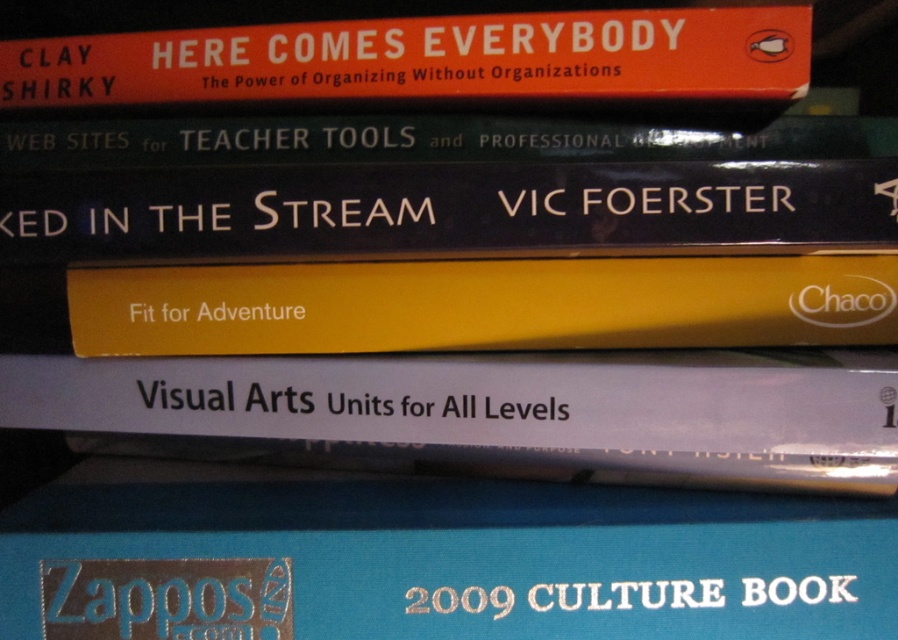
Question: Does white paper at center have a greater width compared to black matte book at center?

Choices:
 (A) yes
 (B) no

Answer: (A)

Question: Which point is closer to the camera?

Choices:
 (A) blue hardcover book at lower center
 (B) yellow matte book at center
 (C) black matte book at center

Answer: (C)

Question: Is black matte book at center closer to the viewer compared to orange matte book at upper center?

Choices:
 (A) yes
 (B) no

Answer: (A)

Question: Is blue hardcover book at lower center below black matte book at center?

Choices:
 (A) yes
 (B) no

Answer: (A)

Question: Which object is farther from the camera taking this photo?

Choices:
 (A) orange matte book at upper center
 (B) white paper at center

Answer: (A)

Question: Which point is closer to the camera taking this photo?

Choices:
 (A) (51, 65)
 (B) (861, 314)
 (C) (468, 128)

Answer: (B)